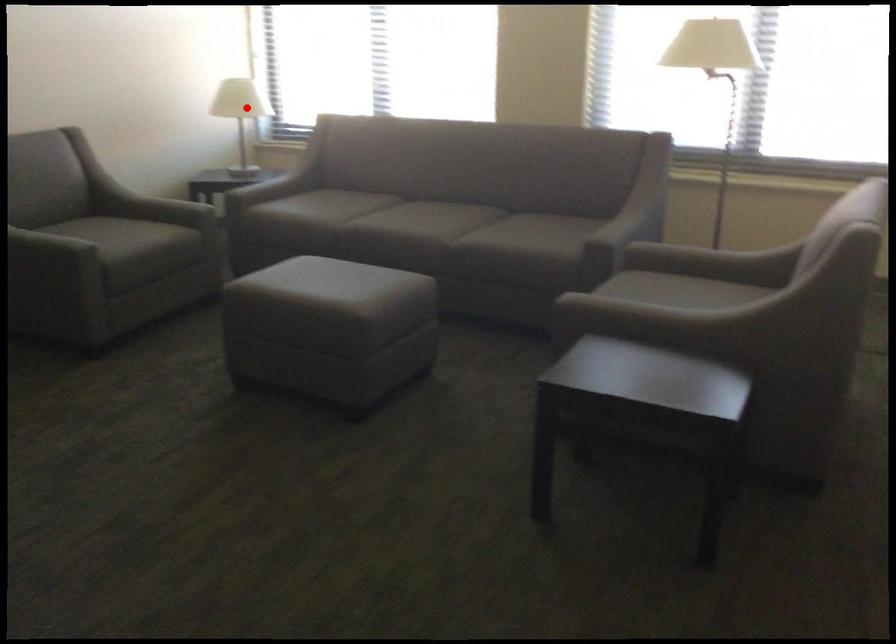
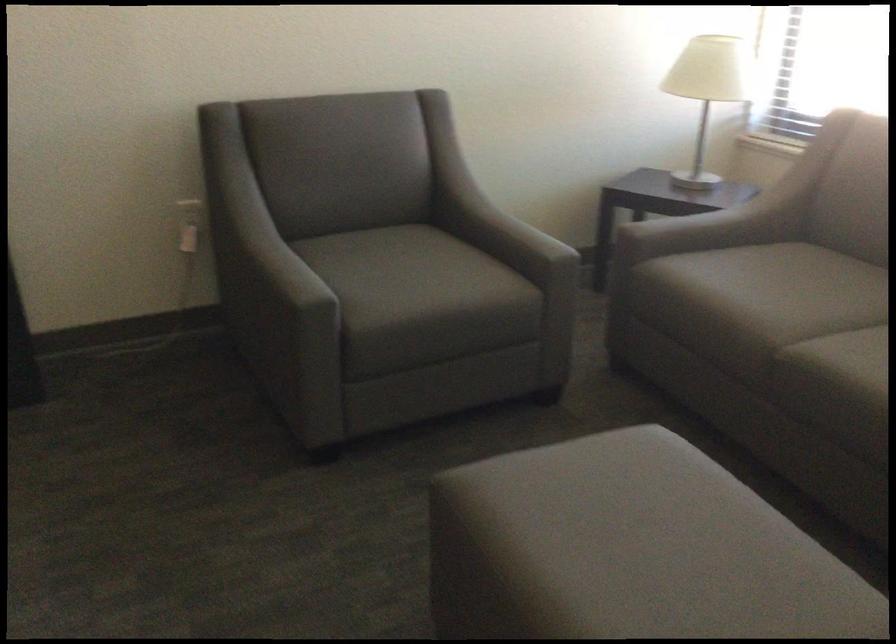
In the second image, find the point that corresponds to the highlighted location in the first image.

(708, 90)